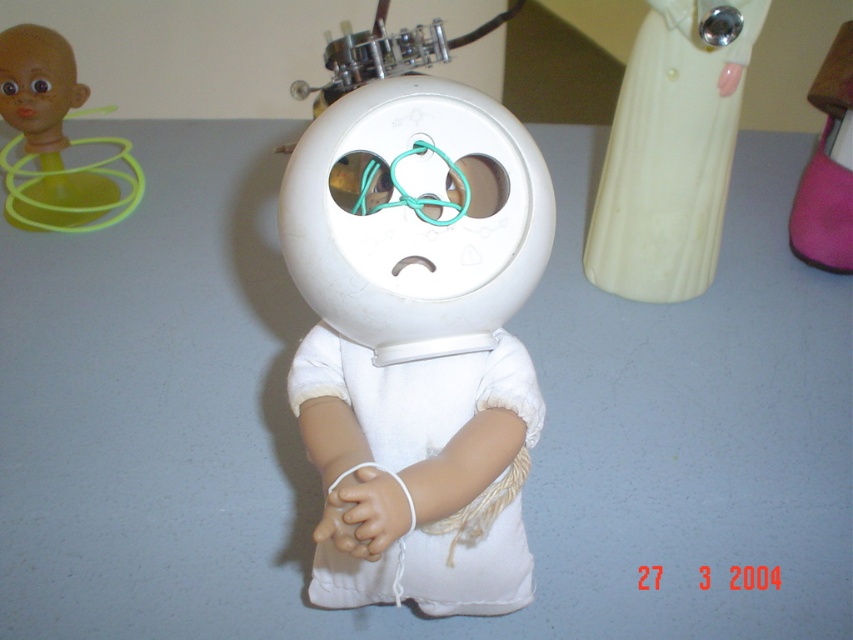
Is point (10, 104) behind point (840, 147)?

Yes, point (10, 104) is farther from viewer.

Can you confirm if matte yellow plastic toy at upper left is positioned to the right of pink fabric doll at right?

In fact, matte yellow plastic toy at upper left is to the left of pink fabric doll at right.

The width and height of the screenshot is (853, 640). Describe the element at coordinates (53, 138) in the screenshot. I see `matte yellow plastic toy at upper left` at that location.

Identify the location of matte yellow plastic toy at upper left. click(x=53, y=138).

Who is taller, white cotton dress at center or white glossy dress at upper right?

Standing taller between the two is white glossy dress at upper right.

Between point (379, 392) and point (695, 179), which one is positioned behind?

Positioned behind is point (695, 179).

Identify the location of white cotton dress at center. [x=419, y=474].

In the scene shown: Is white matte robot at center shorter than white glossy dress at upper right?

Incorrect, white matte robot at center's height does not fall short of white glossy dress at upper right's.

Who is lower down, white matte robot at center or white glossy dress at upper right?

white matte robot at center is below.

Does point (509, 257) come closer to viewer compared to point (730, 61)?

Yes, it is in front of point (730, 61).

This screenshot has width=853, height=640. Identify the location of white matte robot at center. (415, 330).